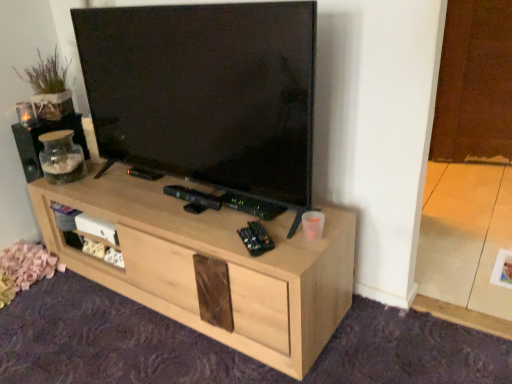
What do you see at coordinates (213, 266) in the screenshot? This screenshot has height=384, width=512. I see `natural wood tv stand at center` at bounding box center [213, 266].

This screenshot has width=512, height=384. What are the coordinates of `natural wood tv stand at center` in the screenshot? It's located at (213, 266).

What do you see at coordinates (41, 143) in the screenshot? The width and height of the screenshot is (512, 384). I see `matte glass jar at left` at bounding box center [41, 143].

Find the location of a particular element. matte glass jar at left is located at coordinates (41, 143).

Identify the location of natural wood tv stand at center. This screenshot has height=384, width=512. (213, 266).

Visually, is matte glass jar at left positioned to the left or to the right of natural wood tv stand at center?

matte glass jar at left is positioned on natural wood tv stand at center's left side.

Which is in front, matte glass jar at left or natural wood tv stand at center?

natural wood tv stand at center.

Does point (55, 125) appear closer or farther from the camera than point (301, 303)?

Point (55, 125).

From the image's perspective, which one is positioned lower, matte glass jar at left or natural wood tv stand at center?

natural wood tv stand at center.

From a real-world perspective, which is physically above, matte glass jar at left or natural wood tv stand at center?

In real-world perspective, matte glass jar at left is above.

Between matte glass jar at left and natural wood tv stand at center, which one has smaller width?

matte glass jar at left.

Considering the sizes of matte glass jar at left and natural wood tv stand at center in the image, is matte glass jar at left taller or shorter than natural wood tv stand at center?

matte glass jar at left is shorter than natural wood tv stand at center.

Considering the sizes of objects matte glass jar at left and natural wood tv stand at center in the image provided, who is smaller, matte glass jar at left or natural wood tv stand at center?

matte glass jar at left is smaller.

Is matte glass jar at left located outside natural wood tv stand at center?

Yes, matte glass jar at left is located beyond the bounds of natural wood tv stand at center.

Is matte glass jar at left next to natural wood tv stand at center and touching it?

No, matte glass jar at left is not with natural wood tv stand at center.

Is natural wood tv stand at center at the back of matte glass jar at left?

No, matte glass jar at left's orientation is not away from natural wood tv stand at center.

Consider the image. What's the angular difference between matte glass jar at left and natural wood tv stand at center's facing directions?

They differ by 2.27 degrees in their facing directions.

Identify the location of speaker above the natural wood tv stand at center (from a real-world perspective). (41, 143).

Is natural wood tv stand at center at the left side of matte glass jar at left?

Incorrect, natural wood tv stand at center is not on the left side of matte glass jar at left.

Which is behind, natural wood tv stand at center or matte glass jar at left?

matte glass jar at left is further from the camera.

Considering the points (151, 261) and (59, 126), which point is in front, point (151, 261) or point (59, 126)?

Positioned in front is point (151, 261).

From the image's perspective, is natural wood tv stand at center on top of matte glass jar at left?

No, from the image's perspective, natural wood tv stand at center is not above matte glass jar at left.

From a real-world perspective, does natural wood tv stand at center sit lower than matte glass jar at left?

Correct, in the physical world, natural wood tv stand at center is lower than matte glass jar at left.

Between natural wood tv stand at center and matte glass jar at left, which one has larger width?

Wider between the two is natural wood tv stand at center.

Considering the sizes of natural wood tv stand at center and matte glass jar at left in the image, is natural wood tv stand at center taller or shorter than matte glass jar at left?

Considering their sizes, natural wood tv stand at center has more height than matte glass jar at left.

Is natural wood tv stand at center bigger or smaller than matte glass jar at left?

natural wood tv stand at center is bigger than matte glass jar at left.

Which is correct: natural wood tv stand at center is inside matte glass jar at left, or outside of it?

natural wood tv stand at center is not enclosed by matte glass jar at left.

Is natural wood tv stand at center touching matte glass jar at left?

natural wood tv stand at center and matte glass jar at left are clearly separated.

Could you tell me if natural wood tv stand at center is turned towards matte glass jar at left?

No, natural wood tv stand at center is not aimed at matte glass jar at left.

How many degrees apart are the facing directions of natural wood tv stand at center and matte glass jar at left?

natural wood tv stand at center and matte glass jar at left are facing 2.27 degrees away from each other.

How distant is natural wood tv stand at center from matte glass jar at left?

A distance of 27.09 inches exists between natural wood tv stand at center and matte glass jar at left.

Find the location of a particular element. desk on the right of the matte glass jar at left is located at coordinates (213, 266).

Identify the location of speaker above the natural wood tv stand at center (from a real-world perspective). pos(41,143).

The width and height of the screenshot is (512, 384). What are the coordinates of `speaker located behind the natural wood tv stand at center` in the screenshot? It's located at (41, 143).